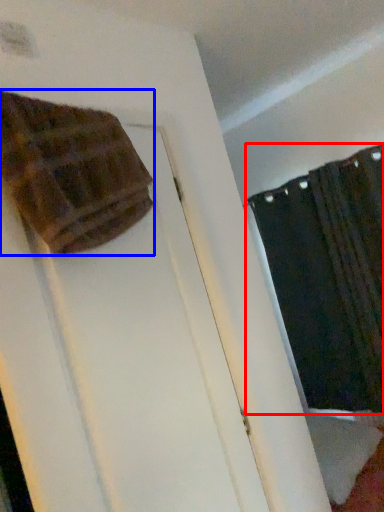
Question: Which of the following is the farthest to the observer, curtain (highlighted by a red box) or blanket (highlighted by a blue box)?

Choices:
 (A) curtain
 (B) blanket

Answer: (A)